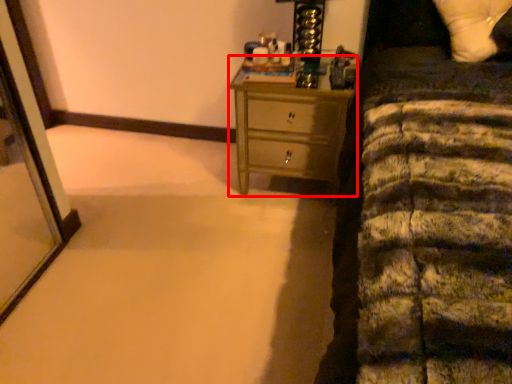
Question: From the image's perspective, what is the correct spatial relationship of chest of drawers (annotated by the red box) in relation to pillow?

Choices:
 (A) below
 (B) above

Answer: (A)